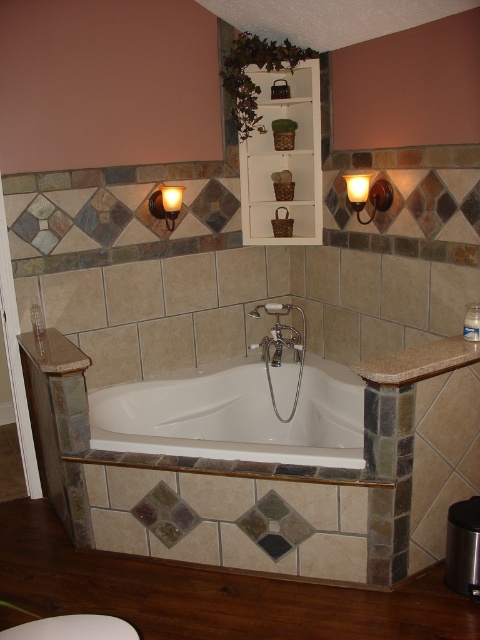
You are standing in the bathroom and want to place a large potted plant on the floor. The potted plant is too heavy to lift, so you need to push it from its current position near the wall to the area between the white glossy bathtub at center and the white glossy toilet bowl at lower left. Is this possible without moving the toilet bowl?

The white glossy bathtub at center is positioned over the white glossy toilet bowl at lower left, meaning there is no space between them on the floor. Therefore, you cannot push the potted plant into that area without moving the toilet bowl.

You are standing in the bathroom and need to locate the white glossy toilet bowl at lower left. According to the scene description, where would you find it?

The white glossy toilet bowl at lower left is located at point coordinates approximately 0.983 on the x axis and 0.152 on the y axis.